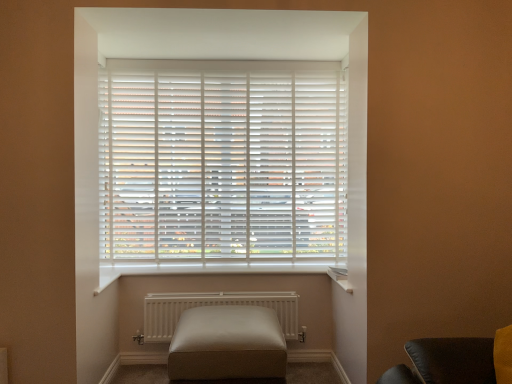
Find the location of a particular element. Image resolution: width=512 pixels, height=384 pixels. white matte radiator at center is located at coordinates (214, 305).

What is the approximate width of leather ottoman at center?

The width of leather ottoman at center is 27.03 inches.

The width and height of the screenshot is (512, 384). What are the coordinates of `white matte radiator at center` in the screenshot? It's located at pyautogui.click(x=214, y=305).

From the image's perspective, who appears lower, white matte blinds at center or leather ottoman at center?

From the image's view, leather ottoman at center is below.

Measure the distance between white matte blinds at center and leather ottoman at center.

white matte blinds at center and leather ottoman at center are 38.81 inches apart from each other.

Looking at the image, does white matte blinds at center seem bigger or smaller compared to leather ottoman at center?

Considering their sizes, white matte blinds at center takes up less space than leather ottoman at center.

Is white matte blinds at center placed right next to leather ottoman at center?

No, white matte blinds at center is not next to leather ottoman at center.

Which is in front, white matte radiator at center or white matte blinds at center?

white matte radiator at center is closer to the camera.

Between white matte radiator at center and white matte blinds at center, which one has smaller size?

white matte radiator at center.

Is white matte radiator at center positioned beyond the bounds of white matte blinds at center?

Yes.

Considering the relative positions of white matte blinds at center and white matte radiator at center in the image provided, is white matte blinds at center to the left or to the right of white matte radiator at center?

Clearly, white matte blinds at center is on the left of white matte radiator at center in the image.

Between white matte blinds at center and white matte radiator at center, which one has smaller size?

white matte radiator at center.

Does white matte blinds at center have a greater width compared to white matte radiator at center?

No, white matte blinds at center is not wider than white matte radiator at center.

Is white matte blinds at center facing towards white matte radiator at center?

No, white matte blinds at center does not turn towards white matte radiator at center.

In the scene shown: Is leather ottoman at center positioned with its back to white matte radiator at center?

Yes, white matte radiator at center is at the back of leather ottoman at center.

Considering the sizes of objects leather ottoman at center and white matte radiator at center in the image provided, who is bigger, leather ottoman at center or white matte radiator at center?

With larger size is leather ottoman at center.

From a real-world perspective, does leather ottoman at center sit lower than white matte radiator at center?

Indeed, from a real-world perspective, leather ottoman at center is positioned beneath white matte radiator at center.

From the image's perspective, is leather ottoman at center on top of white matte radiator at center?

No, from the image's perspective, leather ottoman at center is not on top of white matte radiator at center.

Between leather ottoman at center and white matte blinds at center, which one has less height?

Standing shorter between the two is leather ottoman at center.

Which object is further away from the camera taking this photo, leather ottoman at center or white matte blinds at center?

white matte blinds at center is more distant.

From a real-world perspective, which object rests below the other?

In real-world perspective, leather ottoman at center is lower.

Would you say leather ottoman at center is a long distance from white matte blinds at center?

No, there isn't a large distance between leather ottoman at center and white matte blinds at center.

Between white matte radiator at center and leather ottoman at center, which one has smaller width?

With smaller width is white matte radiator at center.

You are a GUI agent. You are given a task and a screenshot of the screen. Output one action in this format:
    pyautogui.click(x=<x>, y=<y>)
    Task: Click on the radiator above the leather ottoman at center (from a real-world perspective)
    The width and height of the screenshot is (512, 384).
    Given the screenshot: What is the action you would take?
    pyautogui.click(x=214, y=305)

Is white matte radiator at center inside or outside of leather ottoman at center?

white matte radiator at center lies outside leather ottoman at center.

Is white matte radiator at center not close to leather ottoman at center?

No, white matte radiator at center is not far from leather ottoman at center.

Identify the location of furniture below the white matte blinds at center (from the image's perspective). The width and height of the screenshot is (512, 384). (227, 344).

You are a GUI agent. You are given a task and a screenshot of the screen. Output one action in this format:
    pyautogui.click(x=<x>, y=<y>)
    Task: Click on the radiator on the right of the white matte blinds at center
    
    Given the screenshot: What is the action you would take?
    pyautogui.click(x=214, y=305)

Looking at the image, which one is located closer to white matte blinds at center, white matte radiator at center or leather ottoman at center?

Among the two, white matte radiator at center is located nearer to white matte blinds at center.

Looking at the image, which one is located closer to white matte radiator at center, leather ottoman at center or white matte blinds at center?

Among the two, leather ottoman at center is located nearer to white matte radiator at center.

When comparing their distances from white matte blinds at center, does leather ottoman at center or white matte radiator at center seem closer?

The object closer to white matte blinds at center is white matte radiator at center.

Looking at this image, when comparing their distances from white matte radiator at center, does white matte blinds at center or leather ottoman at center seem closer?

leather ottoman at center is closer to white matte radiator at center.

Which object lies further to the anchor point leather ottoman at center, white matte blinds at center or white matte radiator at center?

Based on the image, white matte blinds at center appears to be further to leather ottoman at center.

Considering their positions, is white matte radiator at center positioned further to leather ottoman at center than white matte blinds at center?

Based on the image, white matte blinds at center appears to be further to leather ottoman at center.

In order to click on radiator between white matte blinds at center and leather ottoman at center in the vertical direction in this screenshot , I will do `click(214, 305)`.